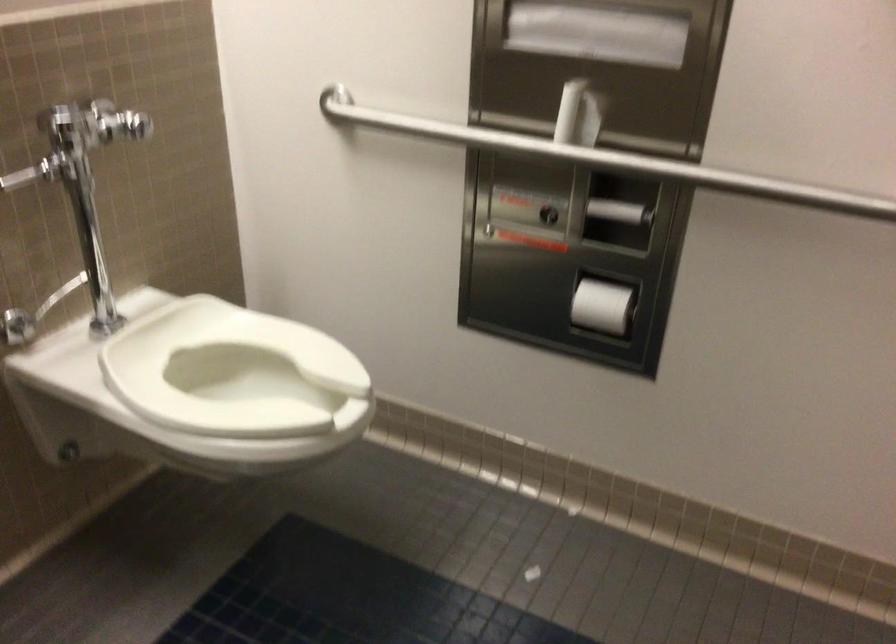
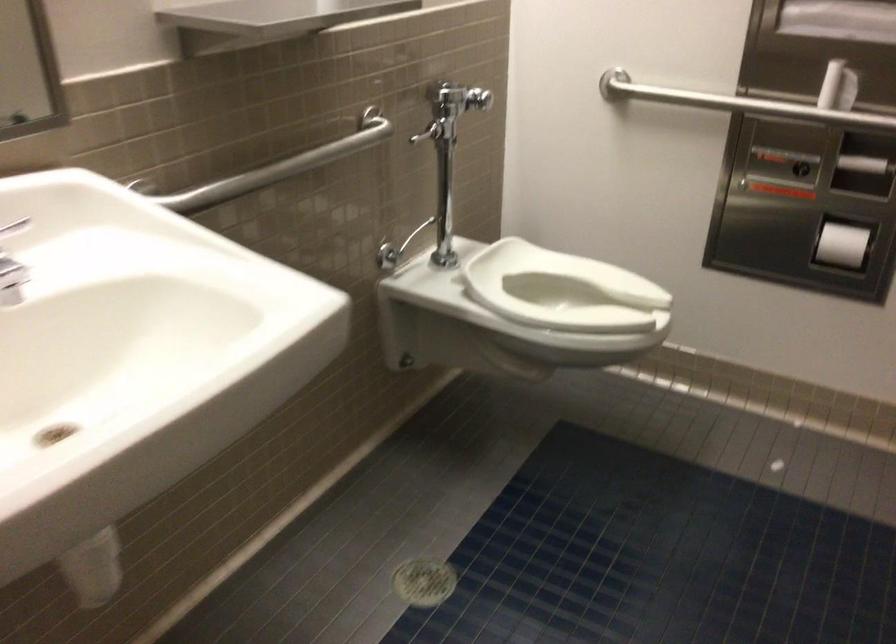
Locate, in the second image, the point that corresponds to the point at 467,140 in the first image.

(739, 104)